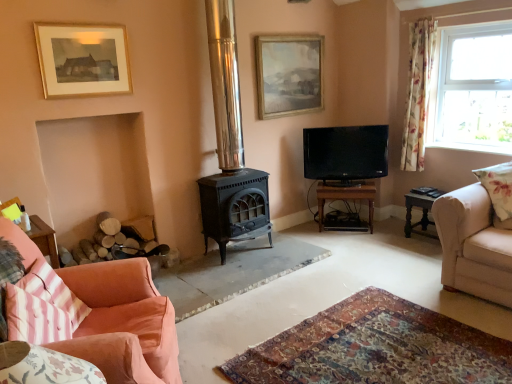
You are a GUI agent. You are given a task and a screenshot of the screen. Output one action in this format:
    pyautogui.click(x=<x>, y=<y>)
    Task: Click on the free region on the left part of dark gray wooden side table at right, the 1th table when ordered from right to left
    Image resolution: width=512 pixels, height=384 pixels.
    Given the screenshot: What is the action you would take?
    pyautogui.click(x=395, y=238)